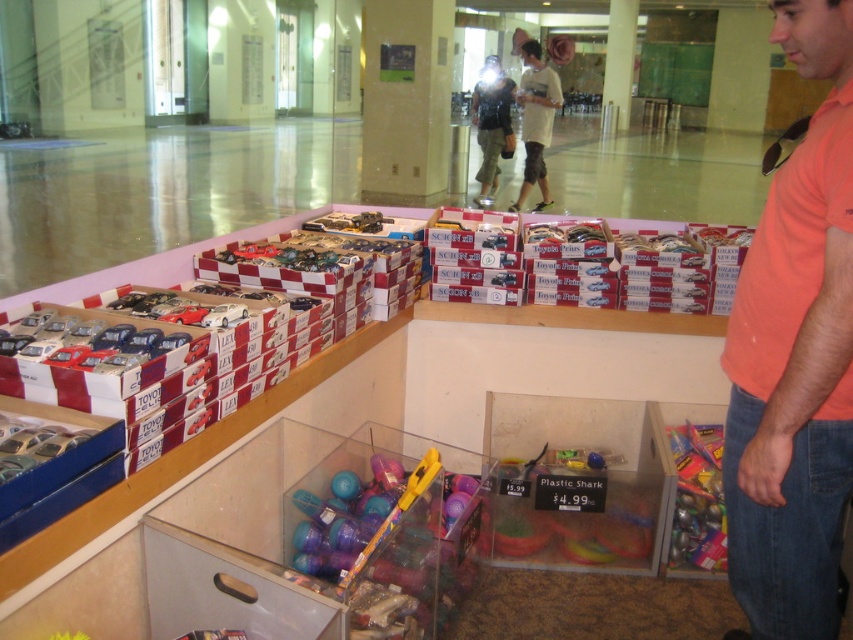
Question: Does orange cotton shirt at right appear on the right side of translucent plastic toy at lower right?

Choices:
 (A) yes
 (B) no

Answer: (B)

Question: Estimate the real-world distances between objects in this image. Which object is closer to the translucent plastic toy at lower right?

Choices:
 (A) matte black backpack at center
 (B) white cotton shirt at upper center
 (C) orange cotton shirt at right

Answer: (C)

Question: Which point is farther to the camera?

Choices:
 (A) (529, 76)
 (B) (683, 429)
 (C) (822, 593)

Answer: (A)

Question: Where is translucent plastic toy at lower right located in relation to matte black backpack at center in the image?

Choices:
 (A) below
 (B) above

Answer: (A)

Question: Which of the following is the closest to the observer?

Choices:
 (A) (509, 116)
 (B) (809, 291)
 (C) (537, 173)
 (D) (692, 538)

Answer: (B)

Question: Does translucent plastic toy at lower right lie in front of matte black backpack at center?

Choices:
 (A) yes
 (B) no

Answer: (A)